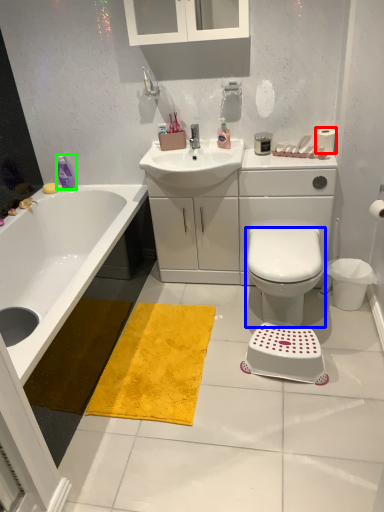
Question: Estimate the real-world distances between objects in this image. Which object is closer to toilet paper (highlighted by a red box), bidet (highlighted by a blue box) or toiletry (highlighted by a green box)?

Choices:
 (A) bidet
 (B) toiletry

Answer: (A)